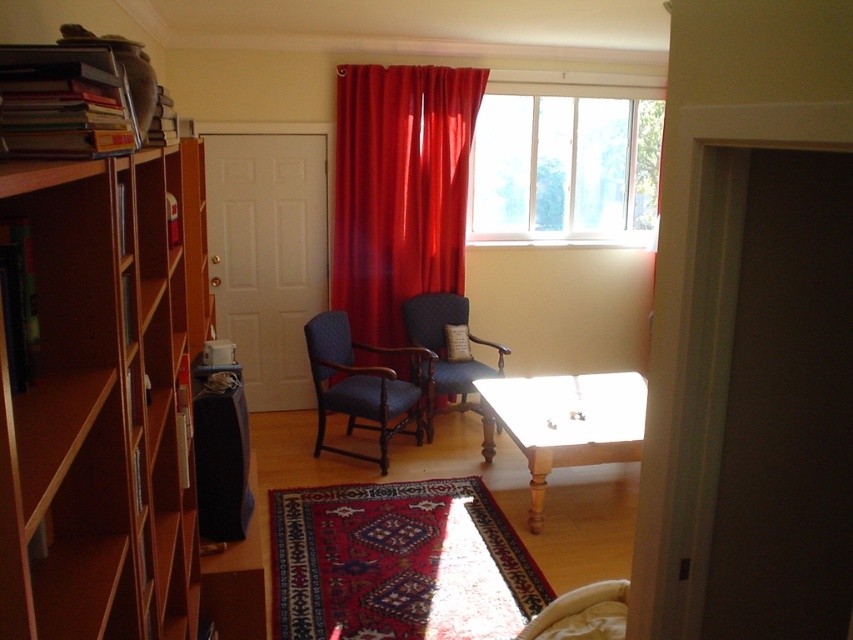
You are standing in the room and want to open the transparent glass window at upper center to let in some fresh air. Considering your height is 5 feet 6 inches, can you reach the window without using a stool?

The transparent glass window at upper center is 17.55 feet from the viewer, which is much higher than your height of 5 feet 6 inches. Therefore, you cannot reach it without a stool.

You are planning to hang a large painting that requires a tall space. You have two options in the room, the velvet red curtain at center and the transparent glass window at upper center. Which one would you choose based on height?

The velvet red curtain at center is much taller than the transparent glass window at upper center, so you should choose the velvet red curtain at center for hanging the large painting.

You are standing in the room and want to place a small decorative item on the point that is closer to you. Which point should you choose between point (x=659, y=150) and point (x=634, y=387)?

Point (x=634, y=387) is closer to you, so you should choose point (x=634, y=387) to place the decorative item.